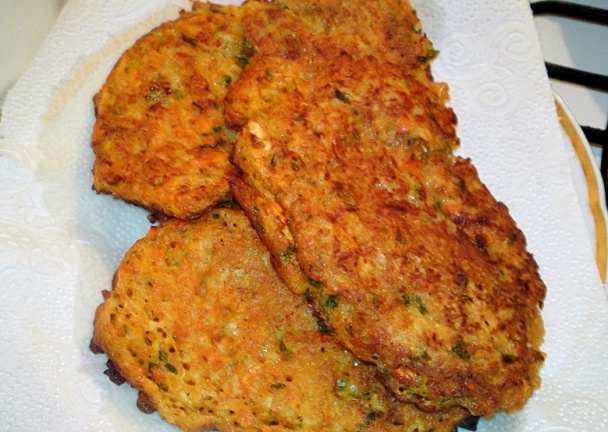
Find the location of a particular element. The width and height of the screenshot is (608, 432). 1980s plate, cause i have some is located at coordinates (585, 163).